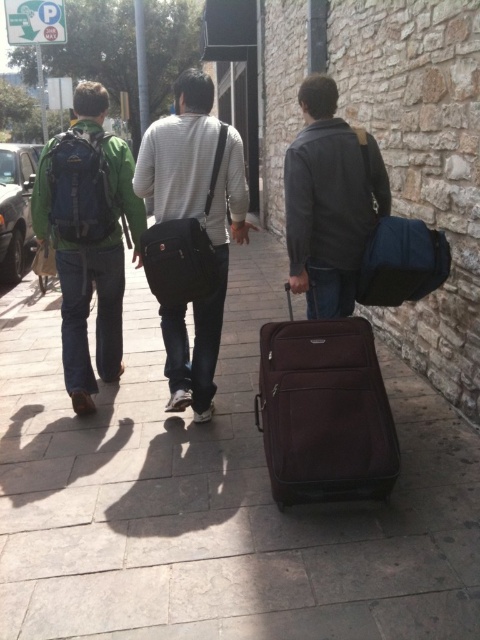
Question: Can you confirm if dark brown fabric suitcase at center is smaller than matte black backpack at left?

Choices:
 (A) yes
 (B) no

Answer: (A)

Question: Estimate the real-world distances between objects in this image. Which object is farther from the matte black backpack at left?

Choices:
 (A) dark gray textured jacket at center
 (B) matte black messenger bag at center
 (C) dark brown fabric suitcase at center

Answer: (C)

Question: From the image, what is the correct spatial relationship of dark brown fabric suitcase at center in relation to matte blue backpack at left?

Choices:
 (A) below
 (B) above

Answer: (A)

Question: Which point is farther from the camera taking this photo?

Choices:
 (A) (205, 164)
 (B) (156, 179)

Answer: (B)

Question: Estimate the real-world distances between objects in this image. Which object is farther from the dark brown fabric suitcase at center?

Choices:
 (A) brown smooth suitcase at center
 (B) dark gray textured jacket at center
 (C) matte black messenger bag at center

Answer: (C)

Question: Where is matte black backpack at left located in relation to matte black messenger bag at center in the image?

Choices:
 (A) right
 (B) left

Answer: (B)